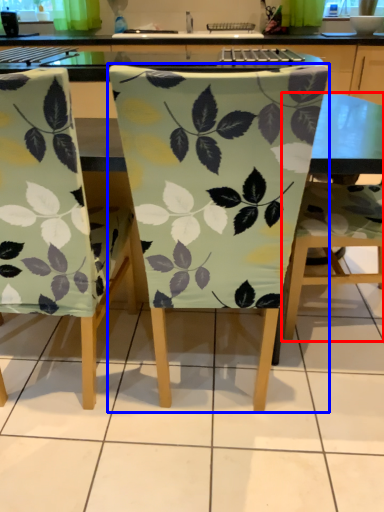
Question: Among these objects, which one is nearest to the camera, chair (highlighted by a red box) or chair (highlighted by a blue box)?

Choices:
 (A) chair
 (B) chair

Answer: (B)